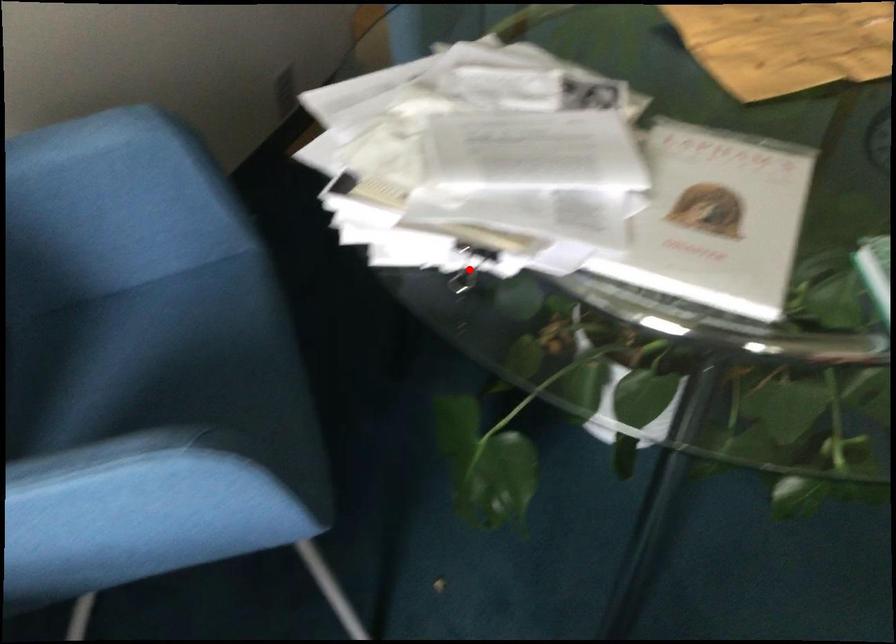
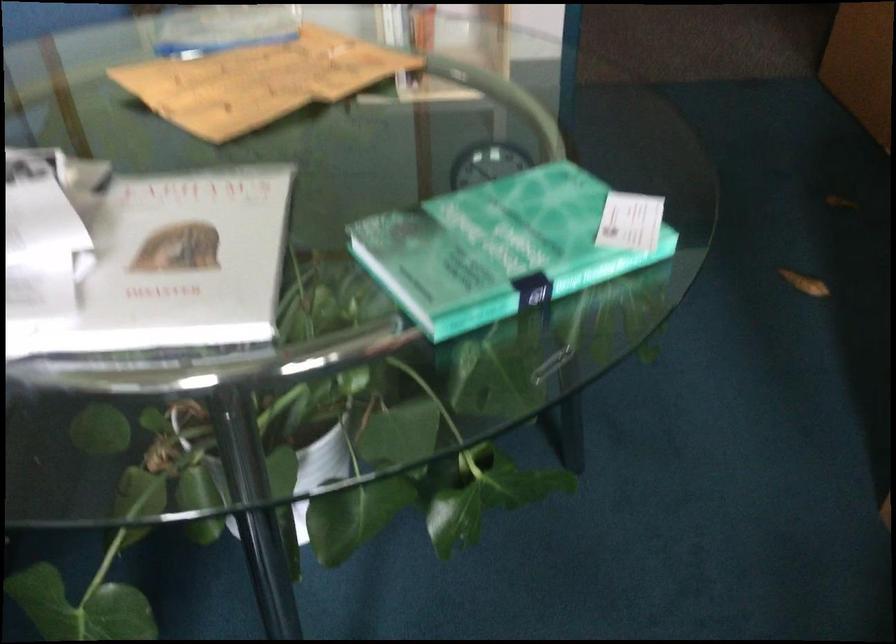
Question: I am providing you with two images of the same scene from different viewpoints. A red point is marked on the first image. At the location where the point appears in image 1, is it still visible in image 2?

Choices:
 (A) Yes
 (B) No

Answer: (B)